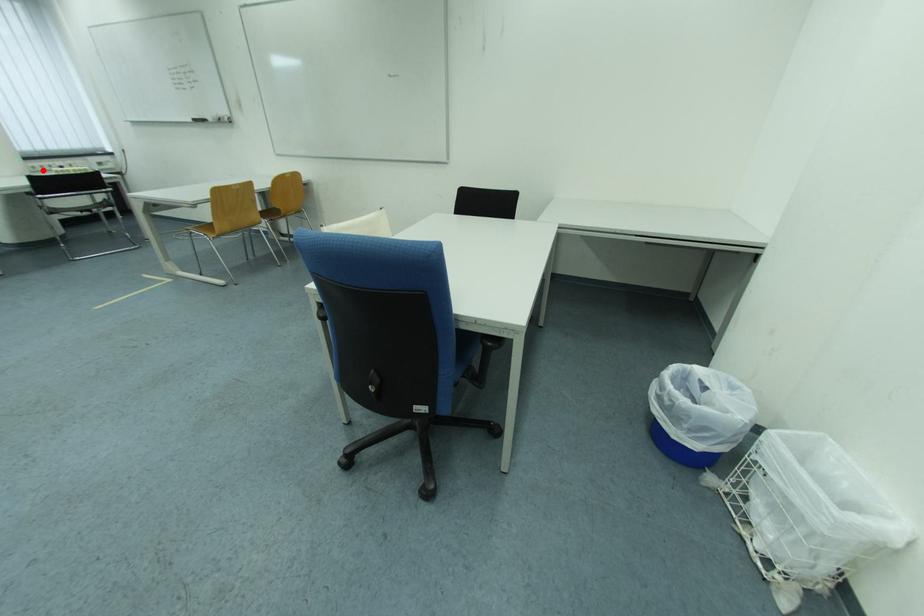
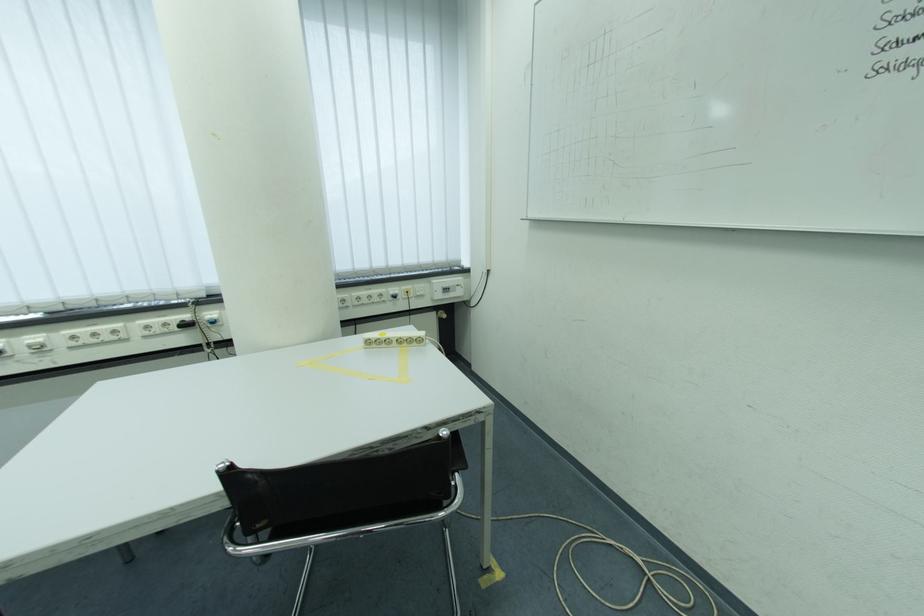
In the second image, find the point that corresponds to the highlighted location in the first image.

(368, 301)